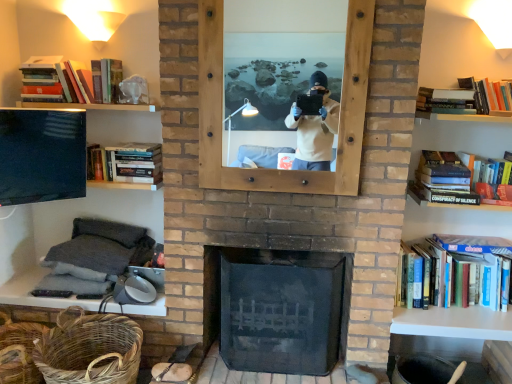
Find the location of `empty space that is ontop of hardcover book at right, acting as the second book starting from the right`. empty space that is ontop of hardcover book at right, acting as the second book starting from the right is located at coordinates (473, 239).